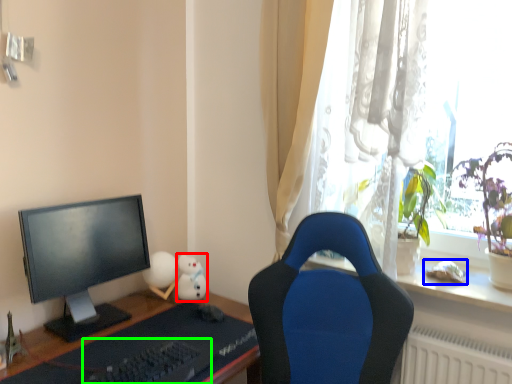
Question: Based on their relative distances, which object is farther from toy (highlighted by a red box)? Choose from toy (highlighted by a blue box) and keyboard (highlighted by a green box).

Choices:
 (A) toy
 (B) keyboard

Answer: (A)